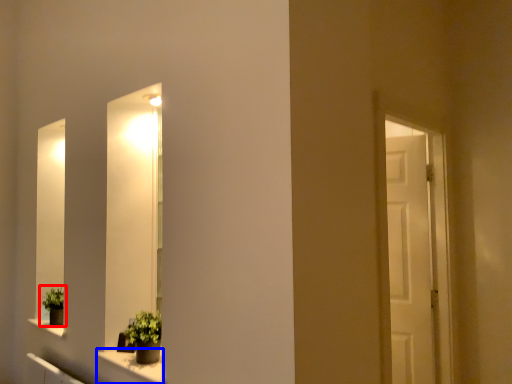
Question: Which object is further to the camera taking this photo, houseplant (highlighted by a red box) or window sill (highlighted by a blue box)?

Choices:
 (A) houseplant
 (B) window sill

Answer: (A)